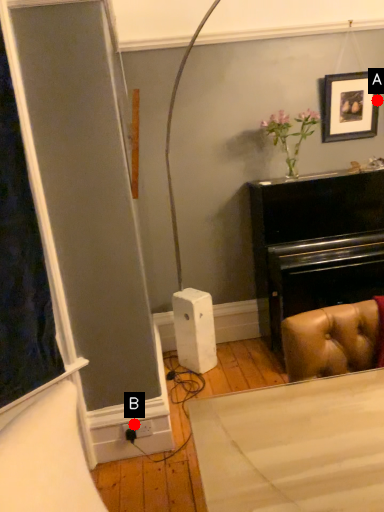
Question: Two points are circled on the image, labeled by A and B beside each circle. Among these points, which one is nearest to the camera?

Choices:
 (A) A is closer
 (B) B is closer

Answer: (B)